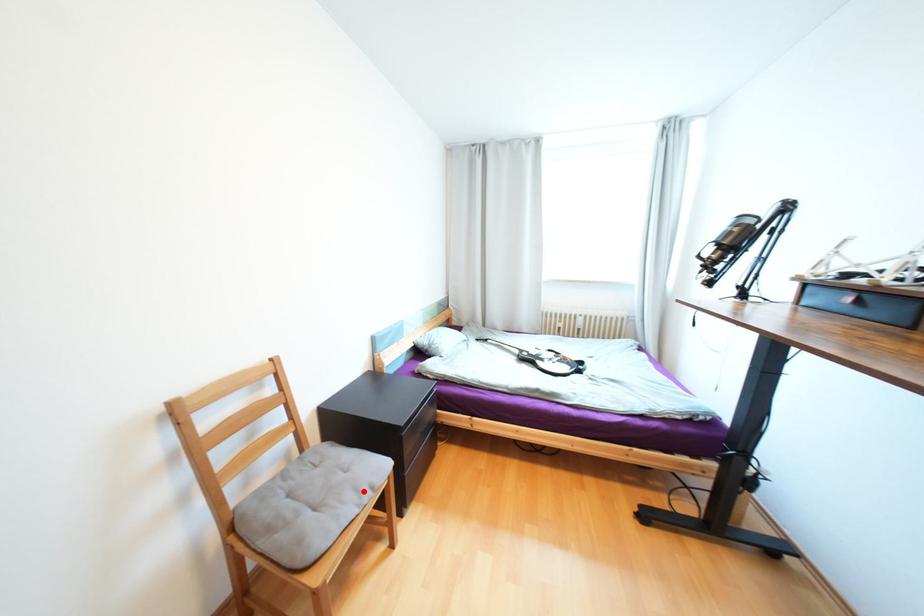
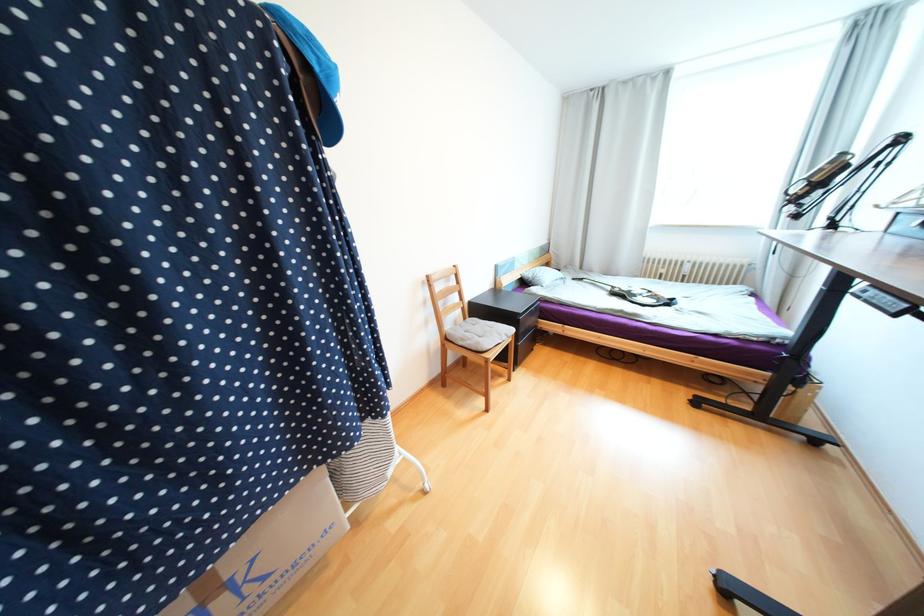
Question: I am providing you with two images of the same scene from different viewpoints. A red point is marked on the first image. Can you still see the location of the red point in image 2?

Choices:
 (A) Yes
 (B) No

Answer: (A)